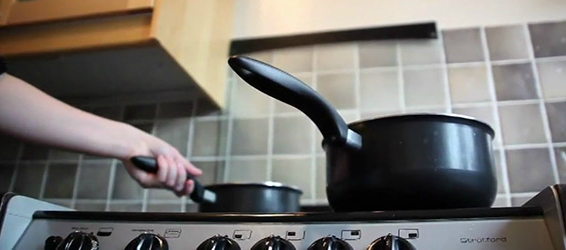
What are the coordinates of `knobs of the stove` in the screenshot? It's located at (385, 239), (327, 241), (274, 243), (205, 245), (147, 237), (67, 239), (47, 239).